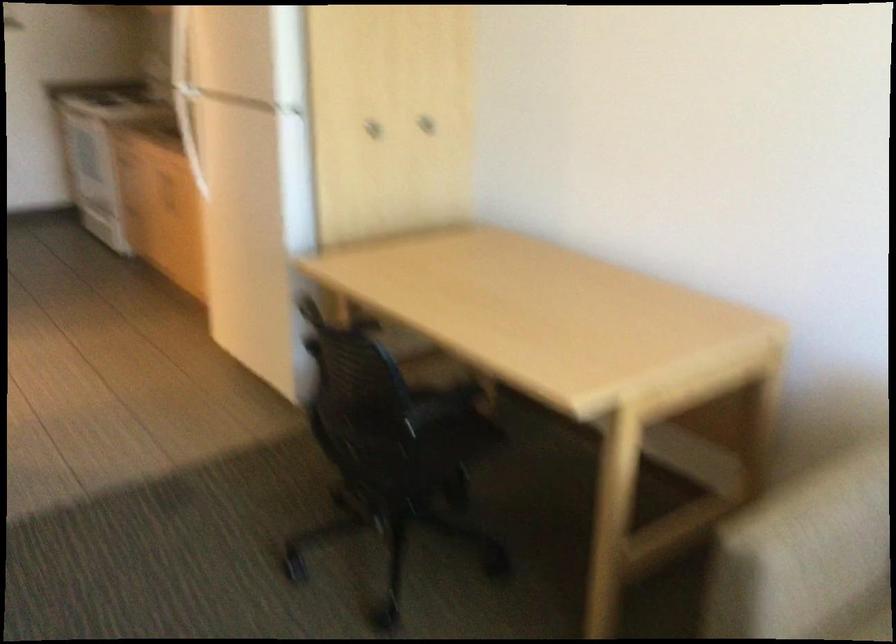
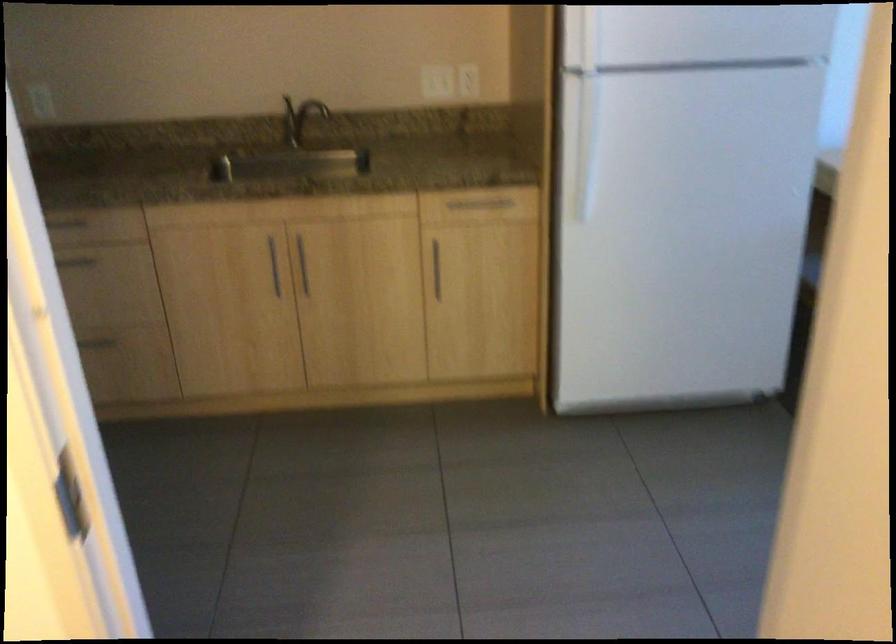
Where in the second image is the point corresponding to point (216, 142) from the first image?

(586, 146)